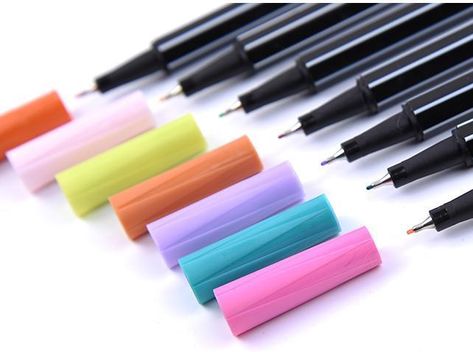
The image size is (473, 352). Identify the location of pen caps. (50, 115), (81, 128), (152, 146), (198, 173), (231, 206), (262, 242), (288, 295).